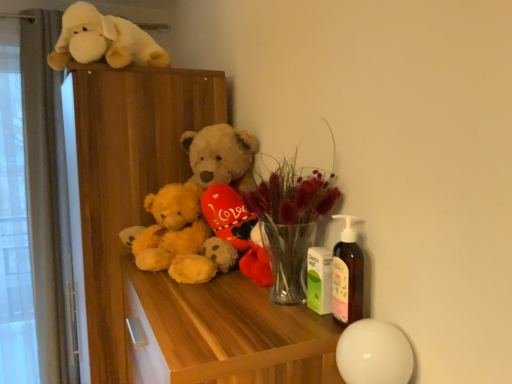
Identify the location of free spot in front of translucent glass vase at center. The height and width of the screenshot is (384, 512). (269, 338).